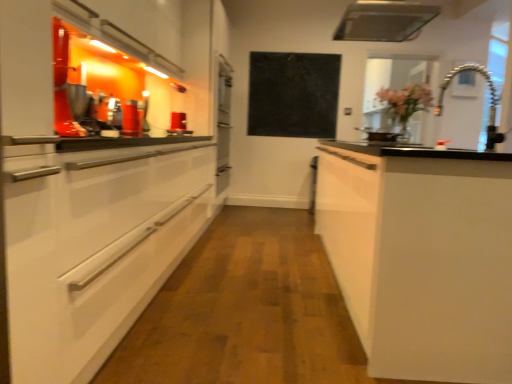
Question: Looking at the image, does flexible metallic faucet at upper right seem bigger or smaller compared to transparent glass window at upper right?

Choices:
 (A) big
 (B) small

Answer: (B)

Question: Considering the positions of flexible metallic faucet at upper right and transparent glass window at upper right in the image, is flexible metallic faucet at upper right wider or thinner than transparent glass window at upper right?

Choices:
 (A) wide
 (B) thin

Answer: (B)

Question: Estimate the real-world distances between objects in this image. Which object is farther from the transparent glass window at upper right?

Choices:
 (A) white matte cabinet at right
 (B) black matte board at center
 (C) flexible metallic faucet at upper right
 (D) metallic silver exhaust hood at upper center

Answer: (A)

Question: Based on their relative distances, which object is farther from the flexible metallic faucet at upper right?

Choices:
 (A) black matte board at center
 (B) white matte cabinet at right
 (C) metallic silver exhaust hood at upper center
 (D) transparent glass window at upper right

Answer: (B)